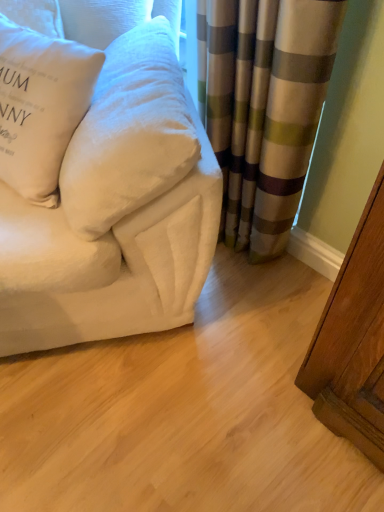
Question: Is white velvety couch at upper left at the back of striped fabric curtain at center?

Choices:
 (A) no
 (B) yes

Answer: (A)

Question: Is striped fabric curtain at center far away from white velvety couch at upper left?

Choices:
 (A) yes
 (B) no

Answer: (B)

Question: Considering the relative positions of striped fabric curtain at center and white velvety couch at upper left in the image provided, is striped fabric curtain at center to the left of white velvety couch at upper left from the viewer's perspective?

Choices:
 (A) no
 (B) yes

Answer: (A)

Question: Does striped fabric curtain at center lie behind white velvety couch at upper left?

Choices:
 (A) yes
 (B) no

Answer: (A)

Question: Is striped fabric curtain at center thinner than white velvety couch at upper left?

Choices:
 (A) no
 (B) yes

Answer: (B)

Question: From a real-world perspective, is white soft pillow at upper left, which is the 1th pillow from left to right, physically located above or below white velvety couch at upper left?

Choices:
 (A) below
 (B) above

Answer: (B)

Question: In the image, is white soft pillow at upper left, which is the 1th pillow from left to right, on the left side or the right side of white velvety couch at upper left?

Choices:
 (A) right
 (B) left

Answer: (B)

Question: From the image's perspective, relative to white velvety couch at upper left, is white soft pillow at upper left, which is the 1th pillow from left to right, above or below?

Choices:
 (A) above
 (B) below

Answer: (A)

Question: Does point (69, 41) appear closer or farther from the camera than point (178, 75)?

Choices:
 (A) closer
 (B) farther

Answer: (B)

Question: From the image's perspective, is white velvety couch at upper left located above or below white velvety pillow at left, which appears as the 1th pillow when viewed from the right?

Choices:
 (A) below
 (B) above

Answer: (B)

Question: Is point (61, 278) positioned closer to the camera than point (102, 106)?

Choices:
 (A) farther
 (B) closer

Answer: (A)

Question: Considering the positions of white velvety couch at upper left and white velvety pillow at left, which appears as the 1th pillow when viewed from the right, in the image, is white velvety couch at upper left bigger or smaller than white velvety pillow at left, which appears as the 1th pillow when viewed from the right,?

Choices:
 (A) big
 (B) small

Answer: (A)

Question: Is white velvety couch at upper left inside the boundaries of white velvety pillow at left, positioned as the 2th pillow in left-to-right order, or outside?

Choices:
 (A) outside
 (B) inside

Answer: (A)

Question: Which is correct: white velvety pillow at left, positioned as the 2th pillow in left-to-right order, is inside white velvety couch at upper left, or outside of it?

Choices:
 (A) inside
 (B) outside

Answer: (A)

Question: From their relative heights in the image, would you say white velvety pillow at left, which appears as the 1th pillow when viewed from the right, is taller or shorter than white velvety couch at upper left?

Choices:
 (A) tall
 (B) short

Answer: (B)